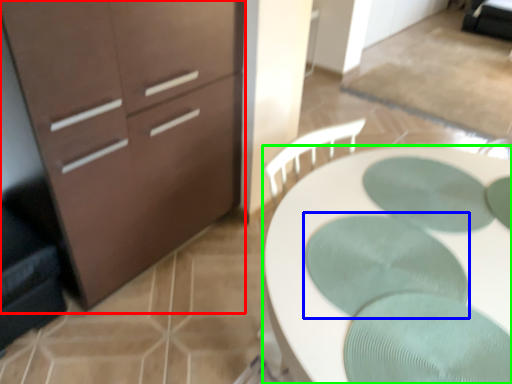
Question: Which object is the closest to the chest of drawers (highlighted by a red box)? Choose among these: oval (highlighted by a blue box) or desk (highlighted by a green box).

Choices:
 (A) oval
 (B) desk

Answer: (B)